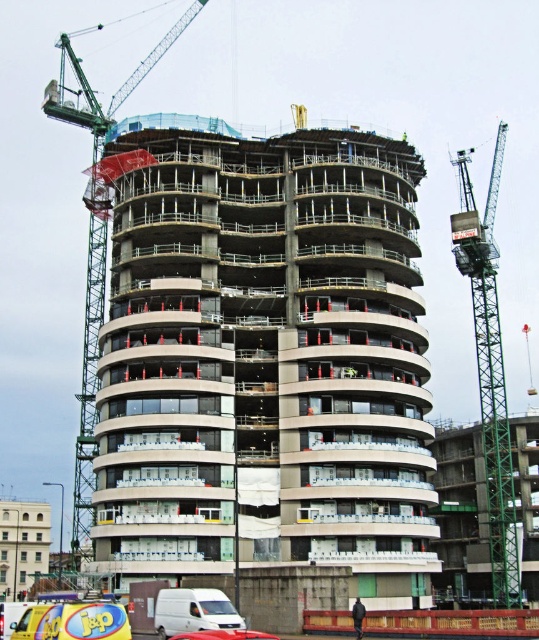
Is point (105, 221) positioned before point (238, 625)?

No, (105, 221) is behind (238, 625).

Is point (93, 310) farther from camera compared to point (205, 628)?

Yes.

At what (x,y) coordinates should I click in order to perform the action: click on green metallic crane at left. Please return your answer as a coordinate pair (x, y). Looking at the image, I should click on (95, 244).

You are a GUI agent. You are given a task and a screenshot of the screen. Output one action in this format:
    pyautogui.click(x=<x>, y=<y>)
    Task: Click on the green metallic crane at left
    The image size is (539, 640).
    Given the screenshot: What is the action you would take?
    pyautogui.click(x=95, y=244)

Between concrete at center and green metallic crane at left, which one has more height?

With more height is green metallic crane at left.

Is concrete at center wider than green metallic crane at left?

In fact, concrete at center might be narrower than green metallic crane at left.

This screenshot has height=640, width=539. Describe the element at coordinates (264, 356) in the screenshot. I see `concrete at center` at that location.

I want to click on concrete at center, so click(x=264, y=356).

Is green metallic crane at right to the left of metallic silver car at center from the viewer's perspective?

In fact, green metallic crane at right is to the right of metallic silver car at center.

Does green metallic crane at right have a greater width compared to metallic silver car at center?

Indeed, green metallic crane at right has a greater width compared to metallic silver car at center.

Does point (499, 508) come in front of point (203, 637)?

That is False.

Locate an element on the screen. This screenshot has width=539, height=640. green metallic crane at right is located at coordinates (489, 369).